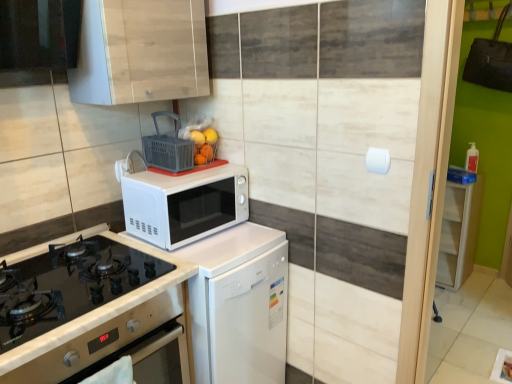
Question: Considering the positions of point (458, 205) and point (220, 317), is point (458, 205) closer or farther from the camera than point (220, 317)?

Choices:
 (A) farther
 (B) closer

Answer: (A)

Question: Considering the relative positions of white wood cabinet at right, which ranks as the first cabinetry in right-to-left order, and white glossy dishwasher at center in the image provided, is white wood cabinet at right, which ranks as the first cabinetry in right-to-left order, to the left or to the right of white glossy dishwasher at center?

Choices:
 (A) left
 (B) right

Answer: (B)

Question: Which object is positioned farthest from the white glossy dishwasher at center?

Choices:
 (A) plastic basket at upper center
 (B) black glass gas stove at lower left
 (C) white wood cabinet at right, arranged as the 1th cabinetry when ordered from the bottom
 (D) orange matte at upper center
 (E) white matte microwave at center

Answer: (C)

Question: Estimate the real-world distances between objects in this image. Which object is farther from the plastic basket at upper center?

Choices:
 (A) black glass exhaust hood at upper left
 (B) matte white oven at lower left
 (C) white plastic electric outlet at upper center
 (D) white wood cabinet at right, acting as the 1th cabinetry starting from the back
 (E) orange matte at upper center

Answer: (D)